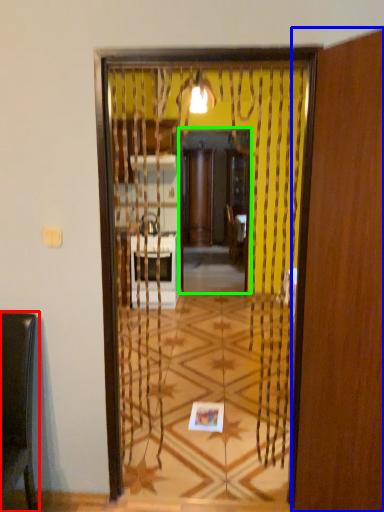
Question: Which object is the farthest from furniture (highlighted by a red box)? Choose among these: screen door (highlighted by a blue box) or screen door (highlighted by a green box).

Choices:
 (A) screen door
 (B) screen door

Answer: (B)